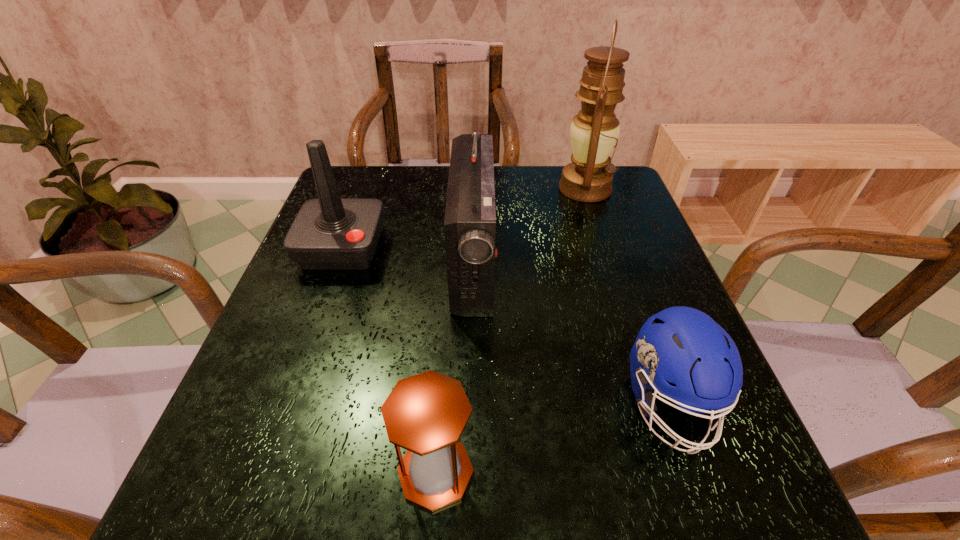
Locate an element on the screen. This screenshot has height=540, width=960. oil lamp is located at coordinates tap(594, 131).

Where is `the farthest object`? the farthest object is located at coordinates (594, 131).

The width and height of the screenshot is (960, 540). I want to click on the fourth shortest object, so click(x=470, y=216).

Find the location of a particular element. joystick is located at coordinates (329, 233).

The height and width of the screenshot is (540, 960). In order to click on the third shortest object in this screenshot , I will do `click(329, 233)`.

The image size is (960, 540). Find the location of `football helmet`. football helmet is located at coordinates (682, 345).

Image resolution: width=960 pixels, height=540 pixels. I want to click on hourglass, so click(426, 414).

Find the location of a particular element. vacant space located on the left of the farthest object is located at coordinates (461, 189).

Identify the location of free space located on the front-facing side of the radio receiver. (588, 264).

The image size is (960, 540). I want to click on vacant point located 0.070m on the back of the third shortest object, so click(357, 208).